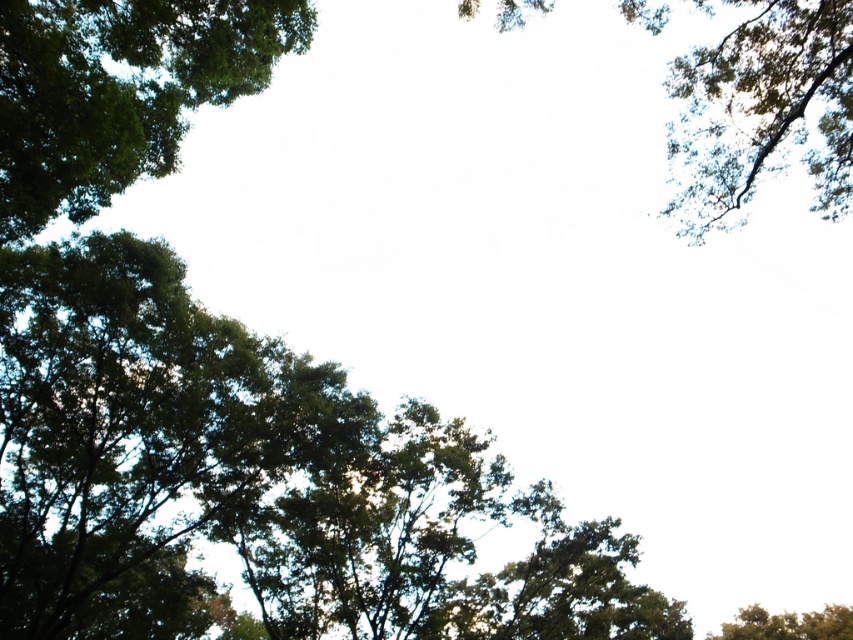
Question: Is green leafy tree at left to the right of green leafy tree at upper right from the viewer's perspective?

Choices:
 (A) yes
 (B) no

Answer: (B)

Question: Which point is closer to the camera?

Choices:
 (A) green leafy tree at upper left
 (B) green leafy tree at lower right

Answer: (A)

Question: Which object is the closest to the green leafy tree at lower right?

Choices:
 (A) green leafy tree at upper right
 (B) green leafy tree at upper left

Answer: (A)

Question: Which of the following is the farthest from the observer?

Choices:
 (A) (477, 3)
 (B) (228, 86)
 (C) (315, 374)

Answer: (C)

Question: Is green leafy tree at left to the right of green leafy tree at upper right from the viewer's perspective?

Choices:
 (A) yes
 (B) no

Answer: (B)

Question: Is green leafy tree at upper left positioned before green leafy tree at lower right?

Choices:
 (A) yes
 (B) no

Answer: (A)